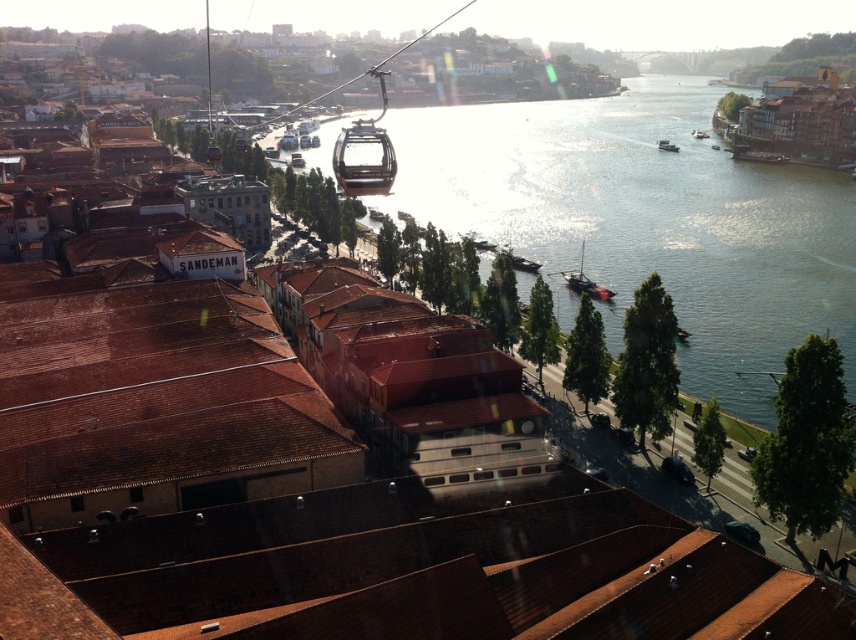
Question: Which point is farther to the camera?

Choices:
 (A) (556, 118)
 (B) (361, 193)

Answer: (A)

Question: Does greenish-blue water at center appear on the right side of matte glass cable car at upper center?

Choices:
 (A) yes
 (B) no

Answer: (A)

Question: Is greenish-blue water at center behind matte glass cable car at upper center?

Choices:
 (A) no
 (B) yes

Answer: (B)

Question: Which point appears closest to the camera in this image?

Choices:
 (A) (634, 102)
 (B) (361, 182)

Answer: (B)

Question: From the image, what is the correct spatial relationship of greenish-blue water at center in relation to matte glass cable car at upper center?

Choices:
 (A) right
 (B) left

Answer: (A)